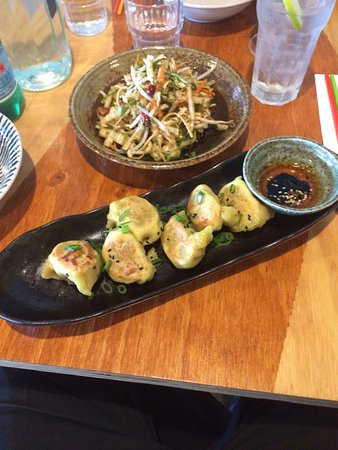
The width and height of the screenshot is (338, 450). Find the location of `bench seating under table`. bench seating under table is located at coordinates (82, 401).